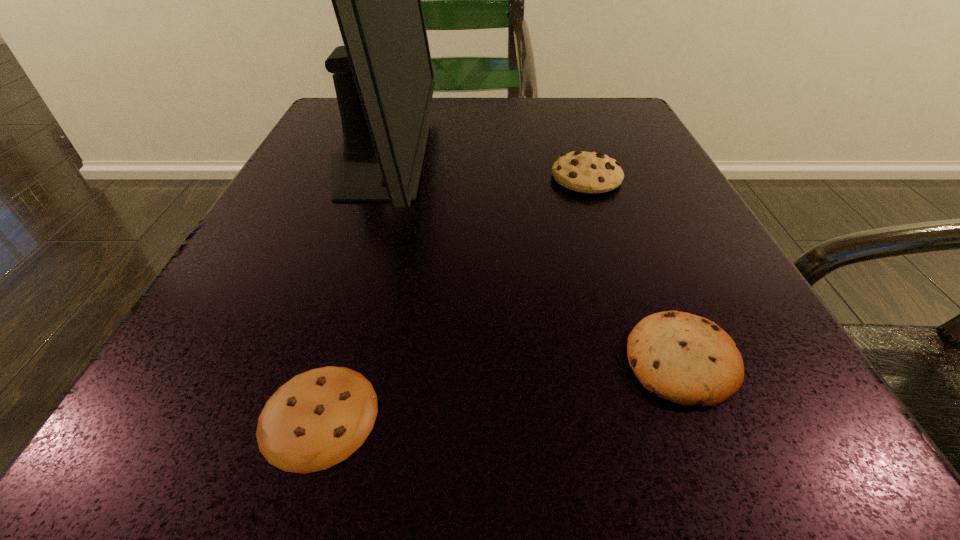
Where is `vacant space that satisfies the following two spatial constraints: 1. on the screen side of the computer monitor; 2. on the back side of the shortest object`? This screenshot has height=540, width=960. vacant space that satisfies the following two spatial constraints: 1. on the screen side of the computer monitor; 2. on the back side of the shortest object is located at coordinates (292, 415).

This screenshot has height=540, width=960. What are the coordinates of `free space that satisfies the following two spatial constraints: 1. on the screen side of the computer monitor; 2. on the left side of the third shortest object` in the screenshot? It's located at (373, 178).

You are a GUI agent. You are given a task and a screenshot of the screen. Output one action in this format:
    pyautogui.click(x=<x>, y=<y>)
    Task: Click on the free region that satisfies the following two spatial constraints: 1. on the back side of the tallest cookie; 2. on the screen side of the computer monitor
    
    Given the screenshot: What is the action you would take?
    pyautogui.click(x=580, y=158)

Where is `vacant area that satisfies the following two spatial constraints: 1. on the screen side of the computer monitor; 2. on the left side of the second shortest object`? The height and width of the screenshot is (540, 960). vacant area that satisfies the following two spatial constraints: 1. on the screen side of the computer monitor; 2. on the left side of the second shortest object is located at coordinates (311, 360).